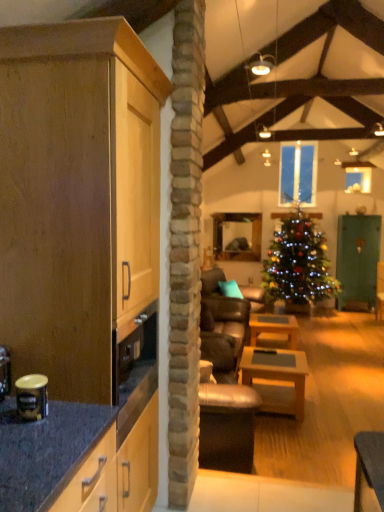
Question: Is light wood cabinet at left further to the viewer compared to wooden table at center, marked as the first table in a back-to-front arrangement?

Choices:
 (A) yes
 (B) no

Answer: (B)

Question: Is light wood cabinet at left facing towards wooden table at center, marked as the first table in a back-to-front arrangement?

Choices:
 (A) no
 (B) yes

Answer: (A)

Question: Can you confirm if light wood cabinet at left is shorter than wooden table at center, marked as the first table in a back-to-front arrangement?

Choices:
 (A) yes
 (B) no

Answer: (B)

Question: From a real-world perspective, is light wood cabinet at left beneath wooden table at center, marked as the first table in a back-to-front arrangement?

Choices:
 (A) yes
 (B) no

Answer: (B)

Question: Is light wood cabinet at left closer to camera compared to wooden table at center, which is counted as the second table, starting from the front?

Choices:
 (A) no
 (B) yes

Answer: (B)

Question: Can you confirm if light wood cabinet at left is thinner than wooden table at center, which is counted as the second table, starting from the front?

Choices:
 (A) no
 (B) yes

Answer: (A)

Question: From a real-world perspective, does light wood cabinet at left stand above teal fabric pillow at center?

Choices:
 (A) no
 (B) yes

Answer: (B)

Question: Is light wood cabinet at left at the left side of teal fabric pillow at center?

Choices:
 (A) no
 (B) yes

Answer: (B)

Question: Can you confirm if light wood cabinet at left is thinner than teal fabric pillow at center?

Choices:
 (A) yes
 (B) no

Answer: (B)

Question: From the image's perspective, is light wood cabinet at left under teal fabric pillow at center?

Choices:
 (A) no
 (B) yes

Answer: (A)

Question: Is teal fabric pillow at center inside light wood cabinet at left?

Choices:
 (A) no
 (B) yes

Answer: (A)

Question: Is light wood cabinet at left positioned before teal fabric pillow at center?

Choices:
 (A) no
 (B) yes

Answer: (B)

Question: Is clear glass window at center not close to light wood cabinet at left?

Choices:
 (A) yes
 (B) no

Answer: (A)